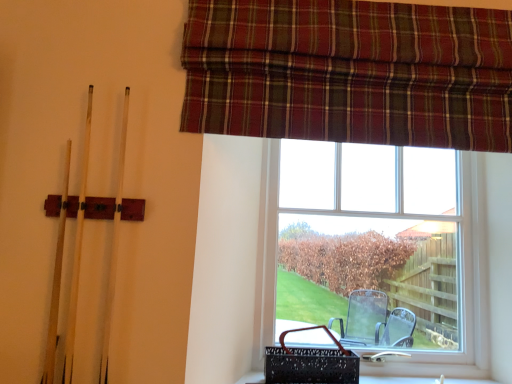
Question: Considering the positions of plaid fabric curtain at upper right and clear glass window at center in the image, is plaid fabric curtain at upper right wider or thinner than clear glass window at center?

Choices:
 (A) wide
 (B) thin

Answer: (B)

Question: From a real-world perspective, relative to clear glass window at center, is plaid fabric curtain at upper right vertically above or below?

Choices:
 (A) above
 (B) below

Answer: (A)

Question: Based on their positions, is plaid fabric curtain at upper right located to the left or right of clear glass window at center?

Choices:
 (A) right
 (B) left

Answer: (B)

Question: Relative to plaid fabric curtain at upper right, is clear glass window at center in front or behind?

Choices:
 (A) behind
 (B) front

Answer: (A)

Question: Is point (329, 158) closer or farther from the camera than point (361, 97)?

Choices:
 (A) farther
 (B) closer

Answer: (A)

Question: Is clear glass window at center wider or thinner than plaid fabric curtain at upper right?

Choices:
 (A) wide
 (B) thin

Answer: (A)

Question: Is clear glass window at center situated inside plaid fabric curtain at upper right or outside?

Choices:
 (A) inside
 (B) outside

Answer: (B)